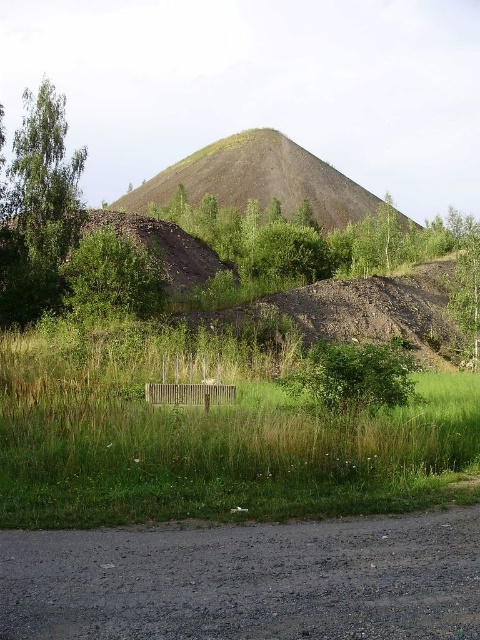
Question: Can you confirm if brown gravel hill at center is positioned below green leafy tree at center?

Choices:
 (A) yes
 (B) no

Answer: (B)

Question: Which point is closer to the camera?

Choices:
 (A) (55, 259)
 (B) (68, 301)
 (C) (382, 499)

Answer: (C)

Question: Does gray gravel road at lower center have a larger size compared to brown gravel hill at center?

Choices:
 (A) yes
 (B) no

Answer: (B)

Question: Which point appears farthest from the camera in this image?

Choices:
 (A) (144, 637)
 (B) (144, 262)
 (C) (8, 188)
 (D) (395, 365)

Answer: (C)

Question: Which point is closer to the camera taking this photo?

Choices:
 (A) (252, 428)
 (B) (309, 355)
 (C) (453, 316)
 (D) (110, 259)

Answer: (A)

Question: Does brown gravel hill at center appear on the right side of green leafy bush at center?

Choices:
 (A) yes
 (B) no

Answer: (A)